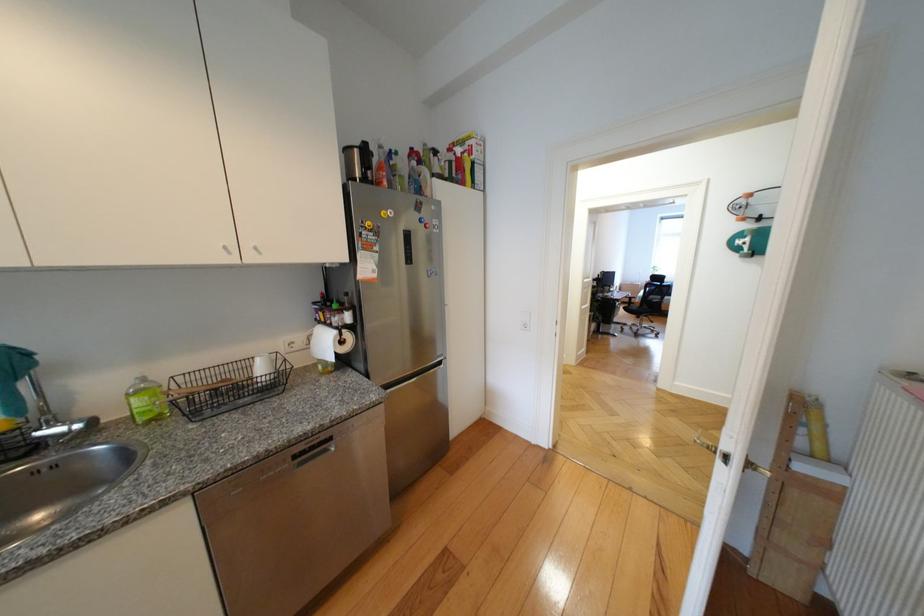
Find where to pull the paper towel roll. Please return your answer as a coordinate pair (x, y).

(322, 342)